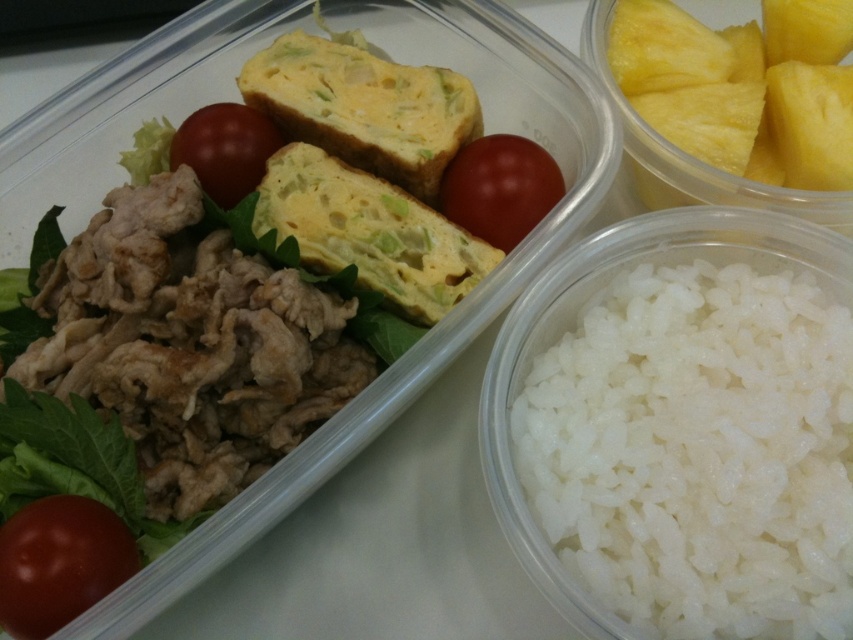
Question: Is yellow juicy pineapple at upper right to the right of red matte tomato at lower left from the viewer's perspective?

Choices:
 (A) yes
 (B) no

Answer: (A)

Question: Which of the following is the closest to the observer?

Choices:
 (A) (235, 148)
 (B) (467, 193)
 (C) (679, 33)
 (D) (111, 577)

Answer: (D)

Question: Which is nearer to the red matte tomato at center?

Choices:
 (A) glossy red tomato at upper center
 (B) red matte tomato at lower left
 (C) yellow juicy pineapple at upper right
 (D) white polished rice at lower right

Answer: (C)

Question: Which object is the farthest from the yellow juicy pineapple at upper right?

Choices:
 (A) glossy red tomato at upper center
 (B) red matte tomato at lower left
 (C) white polished rice at lower right

Answer: (B)

Question: Can you confirm if red matte tomato at lower left is positioned above red matte tomato at center?

Choices:
 (A) no
 (B) yes

Answer: (A)

Question: Can you confirm if white polished rice at lower right is thinner than glossy red tomato at upper center?

Choices:
 (A) no
 (B) yes

Answer: (A)